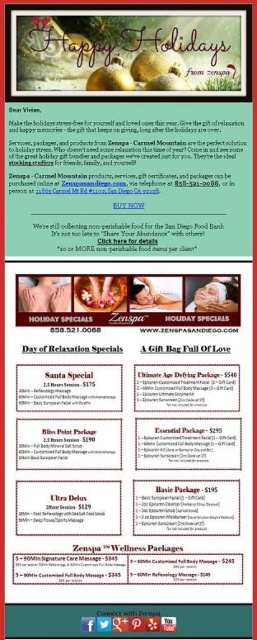
Is point (178, 449) positioned in front of point (161, 51)?

No, (178, 449) is behind (161, 51).

Is matte black gift bag at center taller than matte gold potato at upper center?

Correct, matte black gift bag at center is much taller as matte gold potato at upper center.

In order to click on matte black gift bag at center in this screenshot , I will do `click(187, 444)`.

Can you confirm if white paper at center is bigger than matte black package at center?

Yes, white paper at center is bigger than matte black package at center.

Where is `white paper at center`? The width and height of the screenshot is (257, 640). white paper at center is located at coordinates (129, 236).

Describe the element at coordinates (129, 236) in the screenshot. Image resolution: width=257 pixels, height=640 pixels. I see `white paper at center` at that location.

The image size is (257, 640). Identify the location of white paper at center. 129,236.

Is point (79, 228) farther from camera compared to point (41, 449)?

Yes, point (79, 228) is farther from viewer.

Which is behind, point (54, 243) or point (107, 451)?

The point (54, 243) is behind.

Which is behind, point (49, 230) or point (77, 440)?

The point (49, 230) is behind.

Where is `white paper at center`? This screenshot has height=640, width=257. white paper at center is located at coordinates (129, 236).